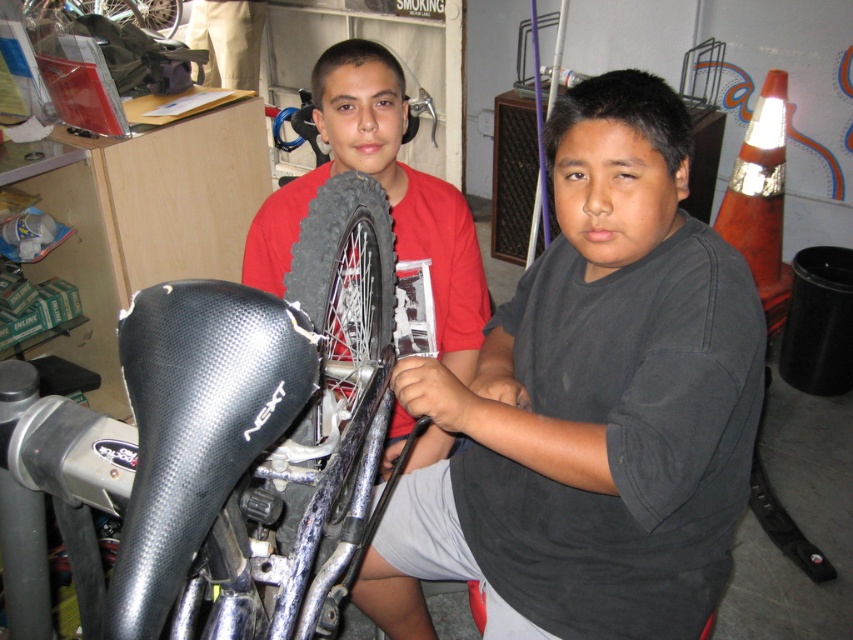
Question: Does shiny metallic tire at upper left appear over black rubber tire at upper left?

Choices:
 (A) yes
 (B) no

Answer: (B)

Question: Which object is closer to the camera taking this photo?

Choices:
 (A) beige fabric pants at upper left
 (B) matte black bicycle wheel at center
 (C) black rubber tire at upper left
 (D) shiny metallic tire at upper left

Answer: (B)

Question: Is black matte shirt at center thinner than matte black bicycle wheel at center?

Choices:
 (A) no
 (B) yes

Answer: (A)

Question: Which point appears farthest from the camera in this image?

Choices:
 (A) (231, 35)
 (B) (71, 8)

Answer: (A)

Question: Which of these objects is positioned closest to the black rubber tire at center?

Choices:
 (A) black matte shirt at center
 (B) shiny metallic tire at upper left

Answer: (A)

Question: Is black matte shirt at center thinner than black rubber tire at center?

Choices:
 (A) no
 (B) yes

Answer: (A)